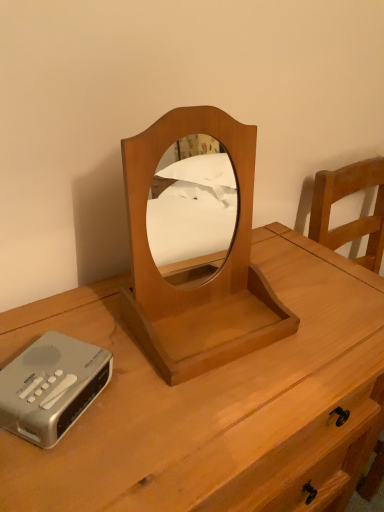
The image size is (384, 512). I want to click on spots to the right of wooden mirror at center, so click(316, 334).